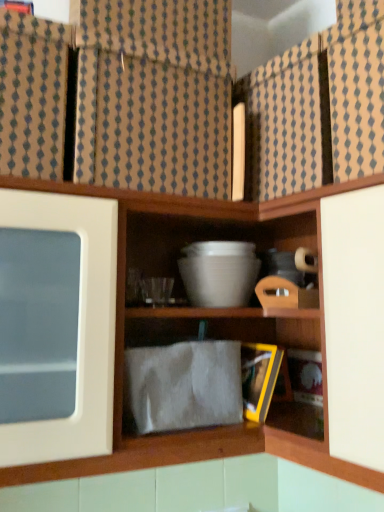
You are a GUI agent. You are given a task and a screenshot of the screen. Output one action in this format:
    pyautogui.click(x=<x>, y=<y>)
    Task: Click on the brown textured fabric at upper center
    This screenshot has width=384, height=512.
    Given the screenshot: What is the action you would take?
    pyautogui.click(x=155, y=96)

Identify the location of white matte bowl at upper center. (319, 108).

From a real-world perspective, between brown textured fabric at upper center and white glossy mixing bowl at center, who is vertically higher?

brown textured fabric at upper center is physically above.

Is brown textured fabric at upper center next to white glossy mixing bowl at center and touching it?

No, brown textured fabric at upper center is not with white glossy mixing bowl at center.

Is brown textured fabric at upper center wider or thinner than white glossy mixing bowl at center?

Clearly, brown textured fabric at upper center has more width compared to white glossy mixing bowl at center.

Is brown textured fabric at upper center surrounding white glossy mixing bowl at center?

That's incorrect, white glossy mixing bowl at center is not inside brown textured fabric at upper center.

From their relative heights in the image, would you say white glossy mixing bowl at center is taller or shorter than brown textured fabric at upper center?

Clearly, white glossy mixing bowl at center is shorter compared to brown textured fabric at upper center.

Which is further, (227, 291) or (183, 160)?

Point (227, 291)

In order to click on mixing bowl located below the brown textured fabric at upper center (from the image's perspective) in this screenshot , I will do `click(219, 273)`.

Does white glossy mixing bowl at center turn towards brown textured fabric at upper center?

No, white glossy mixing bowl at center does not turn towards brown textured fabric at upper center.

The width and height of the screenshot is (384, 512). I want to click on mixing bowl below the white matte bowl at upper center (from the image's perspective), so click(x=219, y=273).

What's the angular difference between white glossy mixing bowl at center and white matte bowl at upper center's facing directions?

76.7 degrees.

From the image's perspective, would you say white glossy mixing bowl at center is positioned over white matte bowl at upper center?

No, from the image's perspective, white glossy mixing bowl at center is not on top of white matte bowl at upper center.

Are white glossy mixing bowl at center and white matte bowl at upper center located far from each other?

No, white glossy mixing bowl at center is not far away from white matte bowl at upper center.

Is white matte bowl at upper center taller or shorter than white glossy mixing bowl at center?

In the image, white matte bowl at upper center appears to be taller than white glossy mixing bowl at center.

Considering the relative positions of white matte bowl at upper center and white glossy mixing bowl at center in the image provided, is white matte bowl at upper center to the left of white glossy mixing bowl at center from the viewer's perspective?

No.

Which object is more forward, white matte bowl at upper center or white glossy mixing bowl at center?

white matte bowl at upper center.

Looking at this image, who is more distant, white matte bowl at upper center or brown textured fabric at upper center?

Positioned behind is white matte bowl at upper center.

Based on the photo, which object is positioned more to the right, white matte bowl at upper center or brown textured fabric at upper center?

white matte bowl at upper center is more to the right.

Considering their positions, is brown textured fabric at upper center located in front of or behind white matte bowl at upper center?

brown textured fabric at upper center is in front of white matte bowl at upper center.

Locate an element on the screen. cabinet below the brown textured fabric at upper center (from the image's perspective) is located at coordinates (319, 108).

Is brown textured fabric at upper center facing away from white matte bowl at upper center?

No, brown textured fabric at upper center's orientation is not away from white matte bowl at upper center.

Based on the photo, how different are the orientations of brown textured fabric at upper center and white matte bowl at upper center in degrees?

The angular difference between brown textured fabric at upper center and white matte bowl at upper center is 73.3 degrees.

Locate an element on the screen. curtain that is above the white glossy mixing bowl at center (from the image's perspective) is located at coordinates (155, 96).

Locate an element on the screen. The height and width of the screenshot is (512, 384). mixing bowl below the brown textured fabric at upper center (from the image's perspective) is located at coordinates [x=219, y=273].

When comparing their distances from white glossy mixing bowl at center, does brown textured fabric at upper center or white matte bowl at upper center seem closer?

white matte bowl at upper center.

Based on their spatial positions, is white matte bowl at upper center or brown textured fabric at upper center closer to white glossy mixing bowl at center?

white matte bowl at upper center is positioned closer to the anchor white glossy mixing bowl at center.

From the image, which object appears to be farther from brown textured fabric at upper center, white glossy mixing bowl at center or white matte bowl at upper center?

white glossy mixing bowl at center is positioned further to the anchor brown textured fabric at upper center.

Considering their positions, is white glossy mixing bowl at center positioned further to white matte bowl at upper center than brown textured fabric at upper center?

Based on the image, white glossy mixing bowl at center appears to be further to white matte bowl at upper center.

Based on their spatial positions, is white matte bowl at upper center or white glossy mixing bowl at center further from brown textured fabric at upper center?

Based on the image, white glossy mixing bowl at center appears to be further to brown textured fabric at upper center.

Which object lies nearer to the anchor point white matte bowl at upper center, brown textured fabric at upper center or white glossy mixing bowl at center?

brown textured fabric at upper center is positioned closer to the anchor white matte bowl at upper center.

In order to click on cabinet between brown textured fabric at upper center and white glossy mixing bowl at center from top to bottom in this screenshot , I will do `click(319, 108)`.